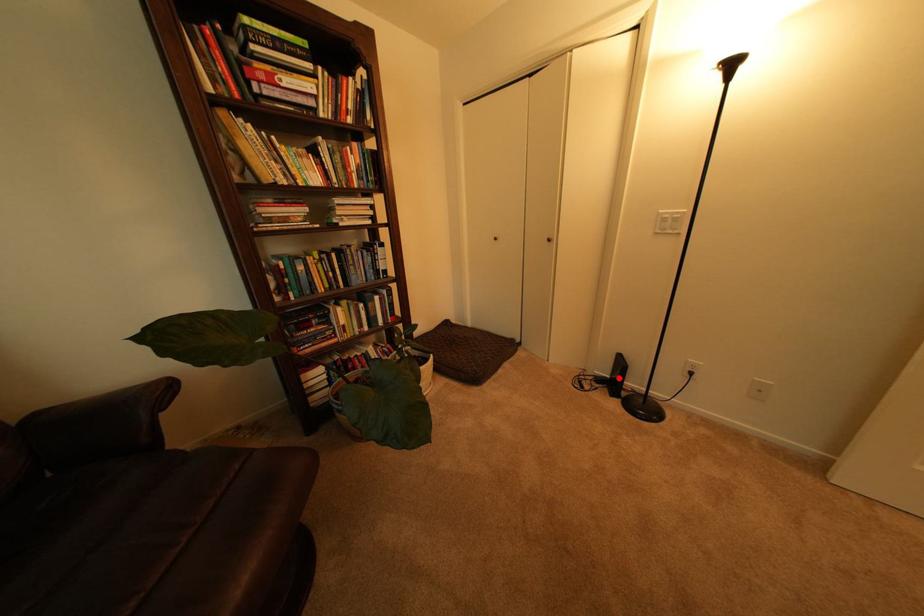
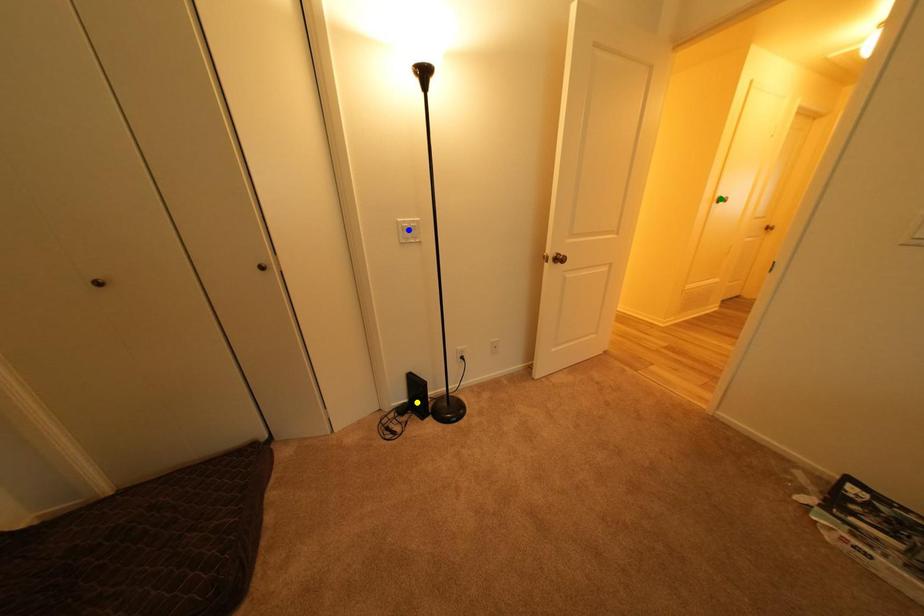
Question: I am providing you with two images of the same scene from different viewpoints. A red point is marked on the first image. You are given multiple points on the second image. In image 2, which mark is for the same physical point as the one in image 1?

Choices:
 (A) blue point
 (B) green point
 (C) yellow point

Answer: (C)